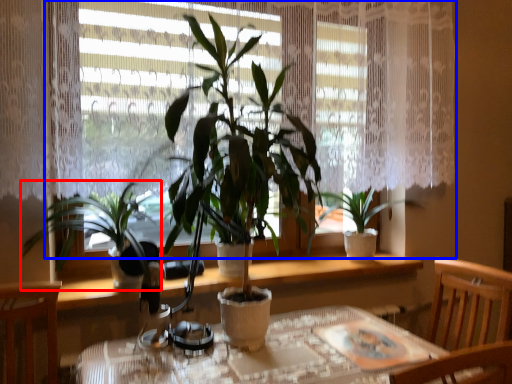
Question: Which point is further to the camera, houseplant (highlighted by a red box) or window (highlighted by a blue box)?

Choices:
 (A) houseplant
 (B) window

Answer: (B)